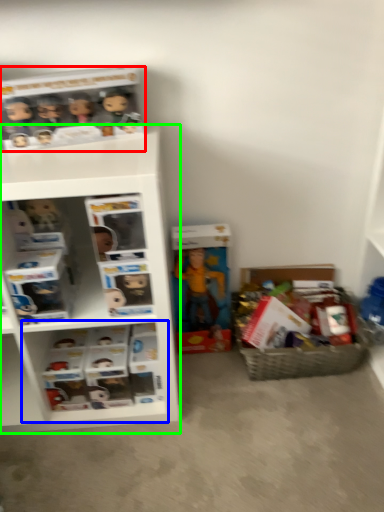
Question: Estimate the real-world distances between objects in this image. Which object is farther from collection (highlighted by a red box), cabinet (highlighted by a blue box) or shelf (highlighted by a green box)?

Choices:
 (A) cabinet
 (B) shelf

Answer: (A)